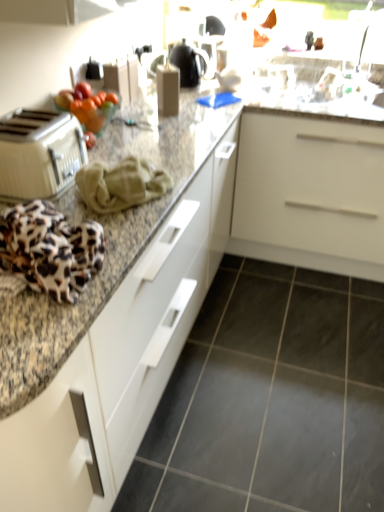
Question: Does beige plastic toaster at left have a lesser height compared to granite countertop at center?

Choices:
 (A) no
 (B) yes

Answer: (B)

Question: Would you consider beige plastic toaster at left to be distant from granite countertop at center?

Choices:
 (A) no
 (B) yes

Answer: (A)

Question: From the image's perspective, is beige plastic toaster at left located above granite countertop at center?

Choices:
 (A) yes
 (B) no

Answer: (A)

Question: From a real-world perspective, does beige plastic toaster at left stand above granite countertop at center?

Choices:
 (A) no
 (B) yes

Answer: (B)

Question: Considering the relative sizes of beige plastic toaster at left and granite countertop at center in the image provided, is beige plastic toaster at left thinner than granite countertop at center?

Choices:
 (A) yes
 (B) no

Answer: (A)

Question: From a real-world perspective, is shiny glass bowl of fruits at upper left physically located above or below gray tile floor at lower center?

Choices:
 (A) below
 (B) above

Answer: (B)

Question: Is shiny glass bowl of fruits at upper left bigger or smaller than gray tile floor at lower center?

Choices:
 (A) small
 (B) big

Answer: (A)

Question: Is shiny glass bowl of fruits at upper left situated inside gray tile floor at lower center or outside?

Choices:
 (A) outside
 (B) inside

Answer: (A)

Question: In the image, is shiny glass bowl of fruits at upper left on the left side or the right side of gray tile floor at lower center?

Choices:
 (A) right
 (B) left

Answer: (B)

Question: Visually, is gray tile floor at lower center positioned to the left or to the right of beige plastic toaster at left?

Choices:
 (A) right
 (B) left

Answer: (A)

Question: Considering the positions of gray tile floor at lower center and beige plastic toaster at left in the image, is gray tile floor at lower center taller or shorter than beige plastic toaster at left?

Choices:
 (A) short
 (B) tall

Answer: (A)

Question: Is gray tile floor at lower center wider or thinner than beige plastic toaster at left?

Choices:
 (A) thin
 (B) wide

Answer: (B)

Question: Looking at the image, does gray tile floor at lower center seem bigger or smaller compared to beige plastic toaster at left?

Choices:
 (A) big
 (B) small

Answer: (A)

Question: Is beige plastic toaster at left wider or thinner than granite countertop at center?

Choices:
 (A) wide
 (B) thin

Answer: (B)

Question: Would you say beige plastic toaster at left is to the left or to the right of granite countertop at center in the picture?

Choices:
 (A) right
 (B) left

Answer: (B)